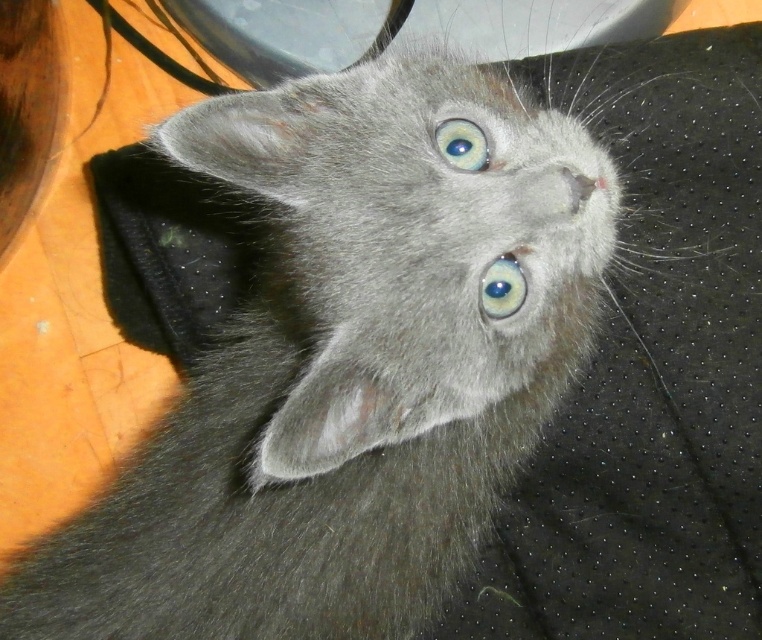
Question: Does blue glossy eye at center have a larger size compared to blue glossy eye at upper center?

Choices:
 (A) no
 (B) yes

Answer: (B)

Question: Is blue glossy eye at center to the right of blue glossy eye at upper center from the viewer's perspective?

Choices:
 (A) yes
 (B) no

Answer: (A)

Question: Which of the following is the closest to the observer?

Choices:
 (A) (506, 316)
 (B) (479, 168)

Answer: (B)

Question: Which object appears farthest from the camera in this image?

Choices:
 (A) blue glossy eye at upper center
 (B) blue glossy eye at center

Answer: (A)

Question: Is blue glossy eye at center further to the viewer compared to blue glossy eye at upper center?

Choices:
 (A) yes
 (B) no

Answer: (B)